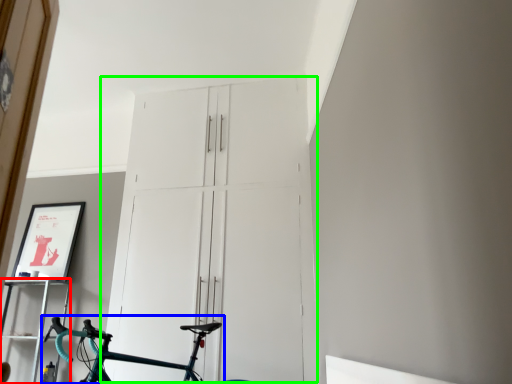
Question: Which is farther away from shelf (highlighted by a red box)? bicycle (highlighted by a blue box) or door (highlighted by a green box)?

Choices:
 (A) bicycle
 (B) door

Answer: (B)